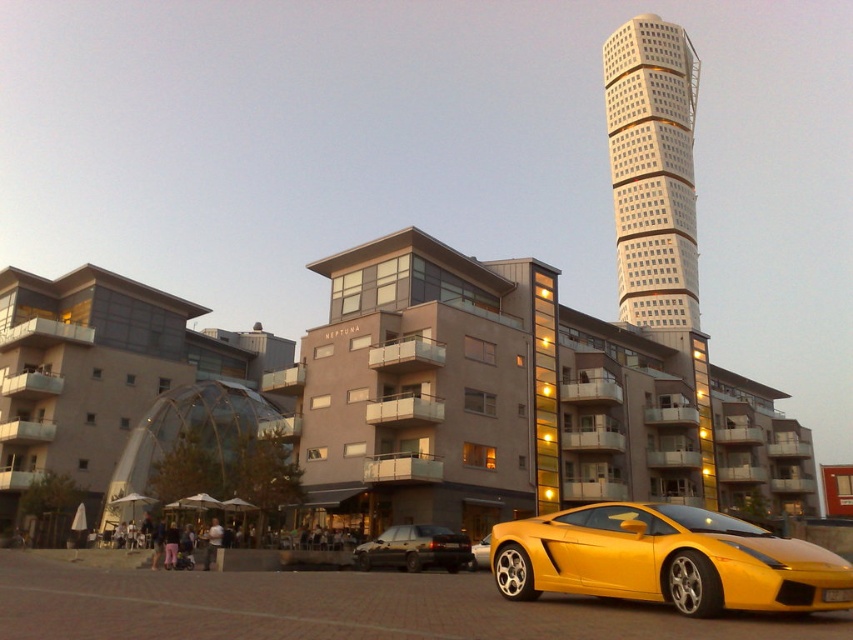
Question: Which object is the farthest from the yellow matte sports car at lower center?

Choices:
 (A) matte black sedan at center
 (B) white glass tower at upper center
 (C) metallic yellow sports car at lower right

Answer: (B)

Question: Does matte black sedan at center appear over yellow matte sports car at lower center?

Choices:
 (A) no
 (B) yes

Answer: (B)

Question: Which point appears closest to the camera in this image?

Choices:
 (A) (474, 557)
 (B) (399, 556)
 (C) (653, 195)
 (D) (675, 540)

Answer: (D)

Question: Does metallic yellow sports car at lower right come in front of matte black sedan at center?

Choices:
 (A) yes
 (B) no

Answer: (A)

Question: Considering the real-world distances, which object is farthest from the metallic yellow sports car at lower right?

Choices:
 (A) white glass tower at upper center
 (B) matte black sedan at center

Answer: (A)

Question: Is metallic yellow sports car at lower right wider than white glass tower at upper center?

Choices:
 (A) yes
 (B) no

Answer: (B)